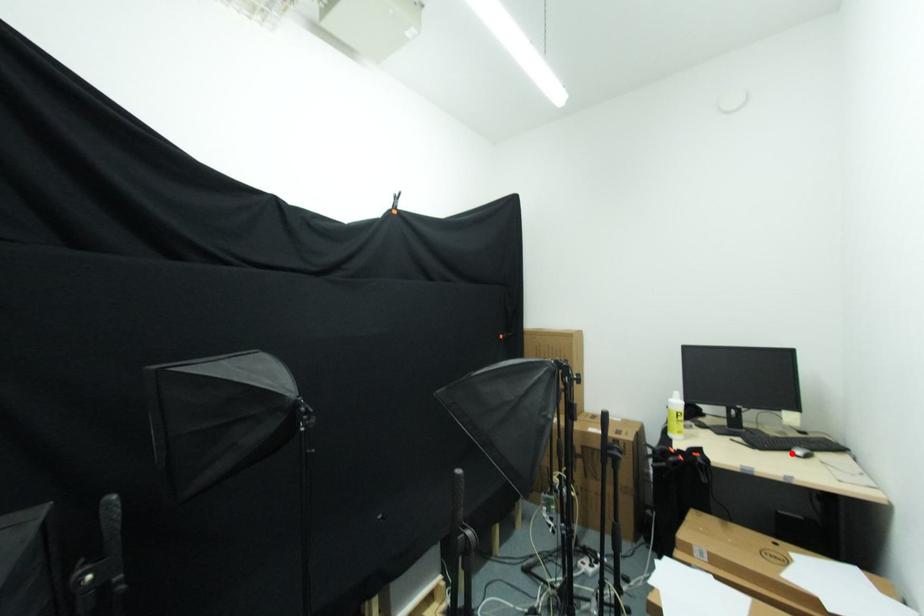
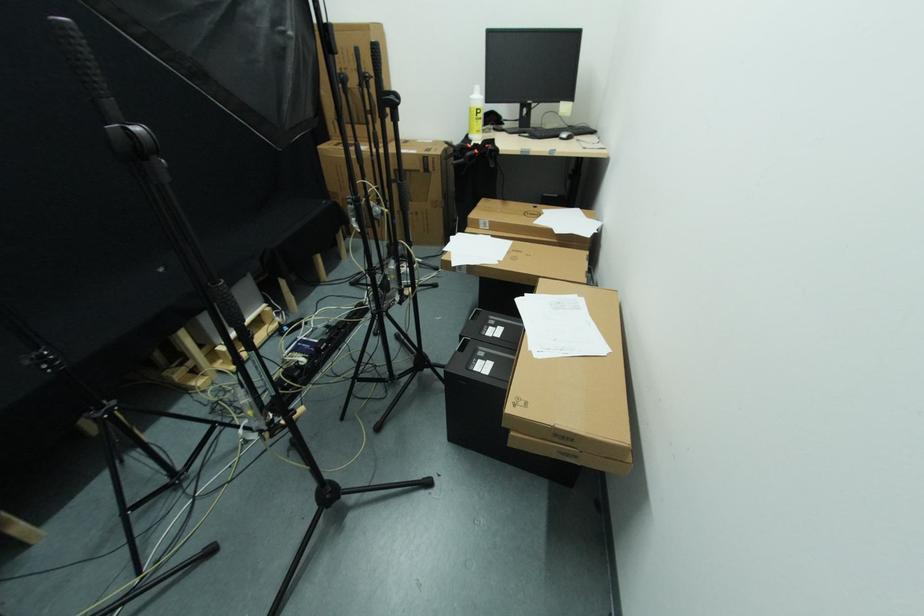
Locate, in the second image, the point that corresponds to the highlighted location in the first image.

(561, 139)